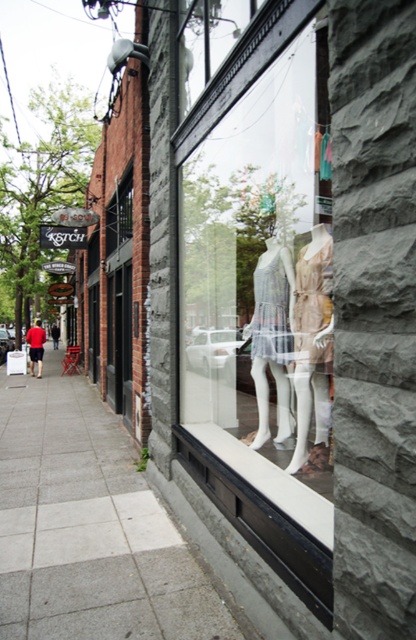
Question: Which of the following is the farthest from the observer?

Choices:
 (A) white sheer fabric dress at center
 (B) red shirt at left

Answer: (B)

Question: Does white matte dress at center come behind red shirt at left?

Choices:
 (A) no
 (B) yes

Answer: (A)

Question: Among these objects, which one is nearest to the camera?

Choices:
 (A) matte white mannequin at center
 (B) white fabric dress at center
 (C) gray concrete sidewalk at lower left
 (D) white sheer fabric dress at center

Answer: (C)

Question: Is transparent glass mannequins at center to the right of white matte dress at center from the viewer's perspective?

Choices:
 (A) yes
 (B) no

Answer: (B)

Question: Which object appears farthest from the camera in this image?

Choices:
 (A) white matte dress at center
 (B) white sheer fabric dress at center
 (C) transparent glass mannequins at center

Answer: (B)

Question: Does transparent glass mannequins at center have a lesser width compared to white matte dress at center?

Choices:
 (A) no
 (B) yes

Answer: (A)